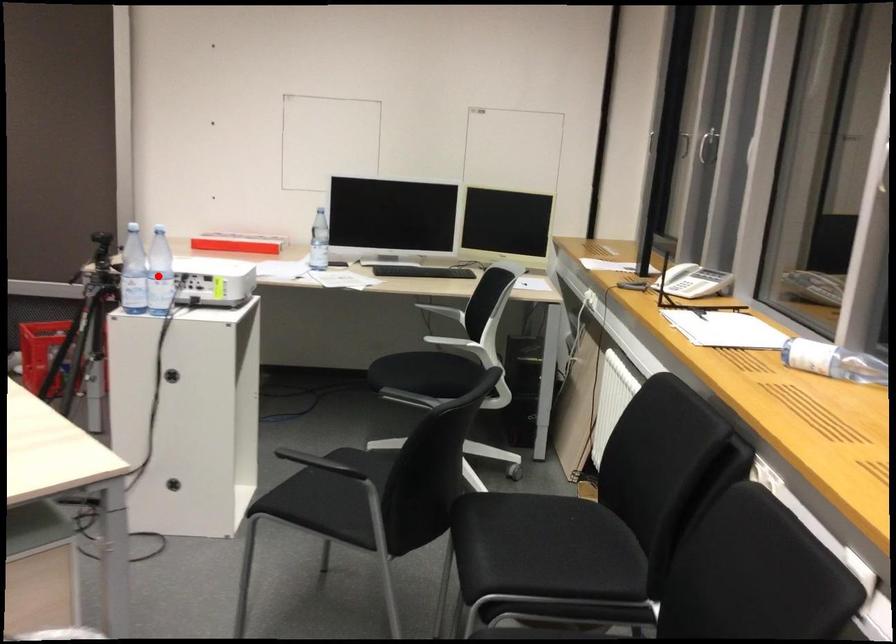
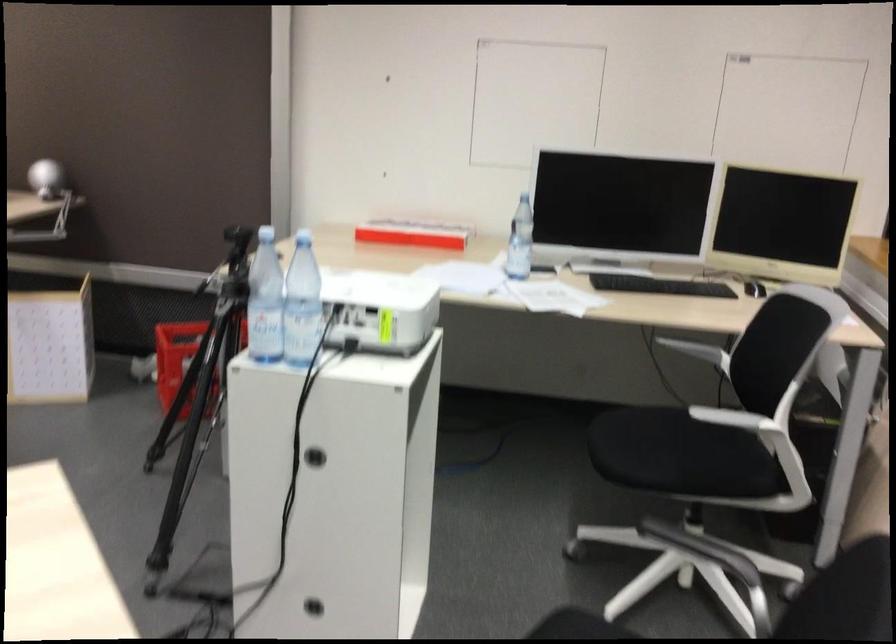
Question: I am providing you with two images of the same scene from different viewpoints. In image1, a red point is highlighted. Considering the same 3D point in image2, which of the following is correct?

Choices:
 (A) It is closer
 (B) It is farther

Answer: (A)